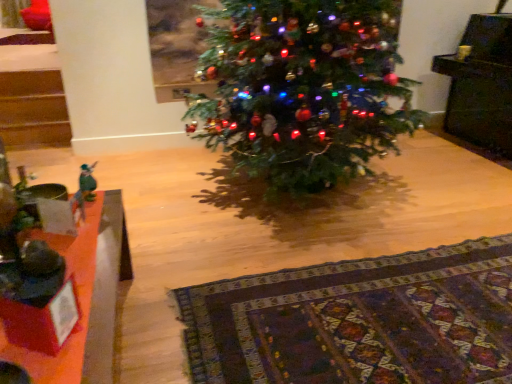
Find the location of a particular element. The image size is (512, 384). free space in front of green felt angel at left is located at coordinates [94, 219].